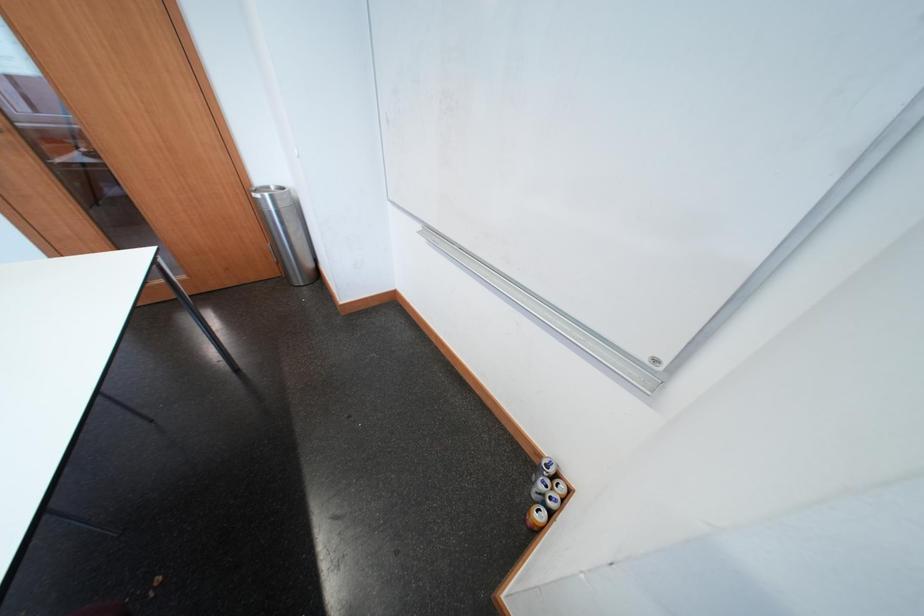
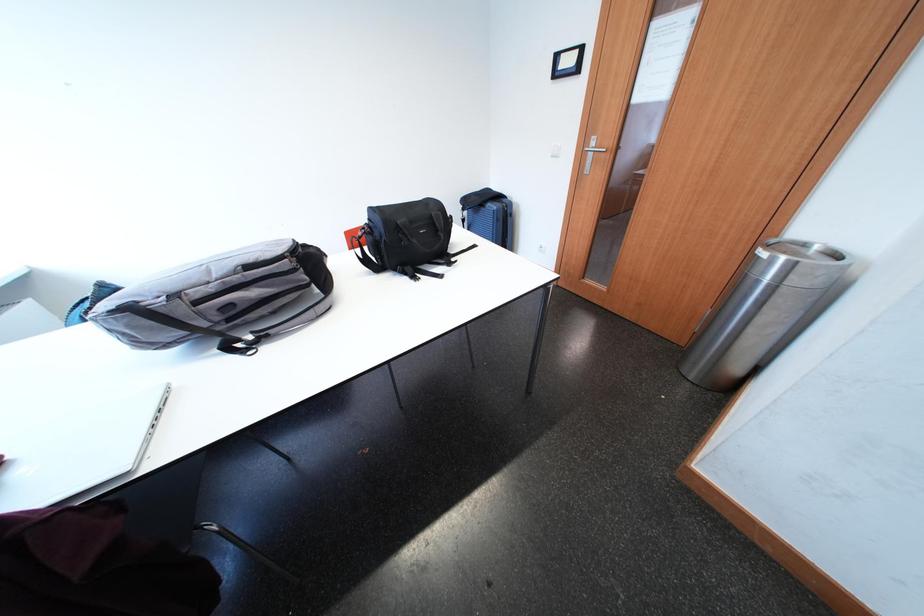
How did the camera likely rotate?

The camera's rotation is toward left-down.